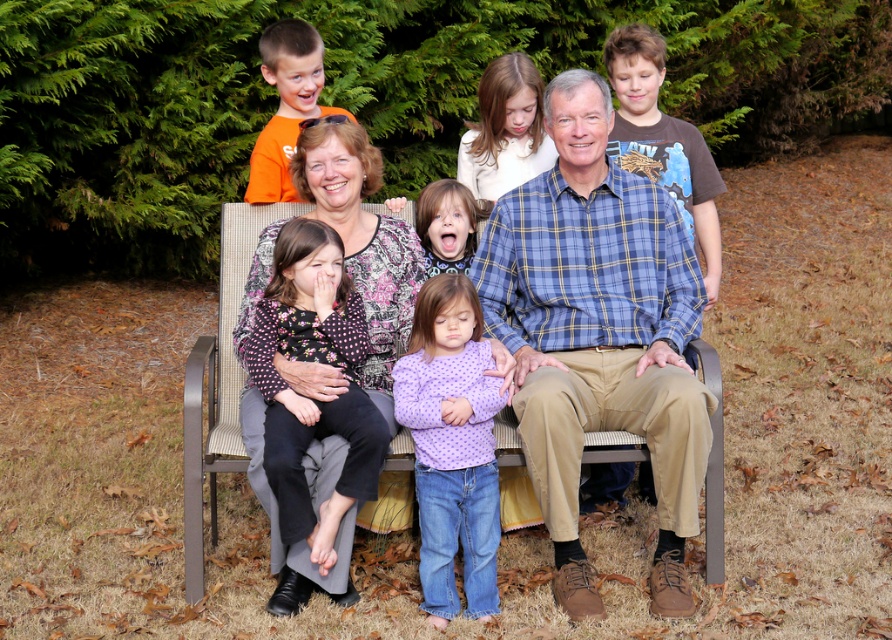
Is floral-patterned shirt at center further to the viewer compared to orange cotton shirt at upper left?

No, floral-patterned shirt at center is in front of orange cotton shirt at upper left.

Which is behind, point (268, 608) or point (288, 54)?

Positioned behind is point (288, 54).

I want to click on floral-patterned shirt at center, so click(315, 406).

Does purple polka dot shirt at center have a greater height compared to matte purple shirt at center?

Correct, purple polka dot shirt at center is much taller as matte purple shirt at center.

Who is positioned more to the left, purple polka dot shirt at center or matte purple shirt at center?

From the viewer's perspective, matte purple shirt at center appears more on the left side.

Describe the element at coordinates (451, 444) in the screenshot. I see `purple polka dot shirt at center` at that location.

The width and height of the screenshot is (892, 640). Identify the location of purple polka dot shirt at center. (451, 444).

The height and width of the screenshot is (640, 892). Describe the element at coordinates (599, 332) in the screenshot. I see `matte plaid shirt at center` at that location.

What are the coordinates of `matte plaid shirt at center` in the screenshot? It's located at coord(599,332).

Locate an element on the screen. Image resolution: width=892 pixels, height=640 pixels. matte plaid shirt at center is located at coordinates (599, 332).